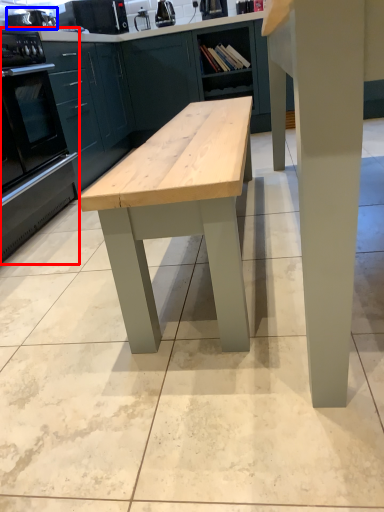
Question: Among these objects, which one is nearest to the camera, oven (highlighted by a red box) or appliance (highlighted by a blue box)?

Choices:
 (A) oven
 (B) appliance

Answer: (A)